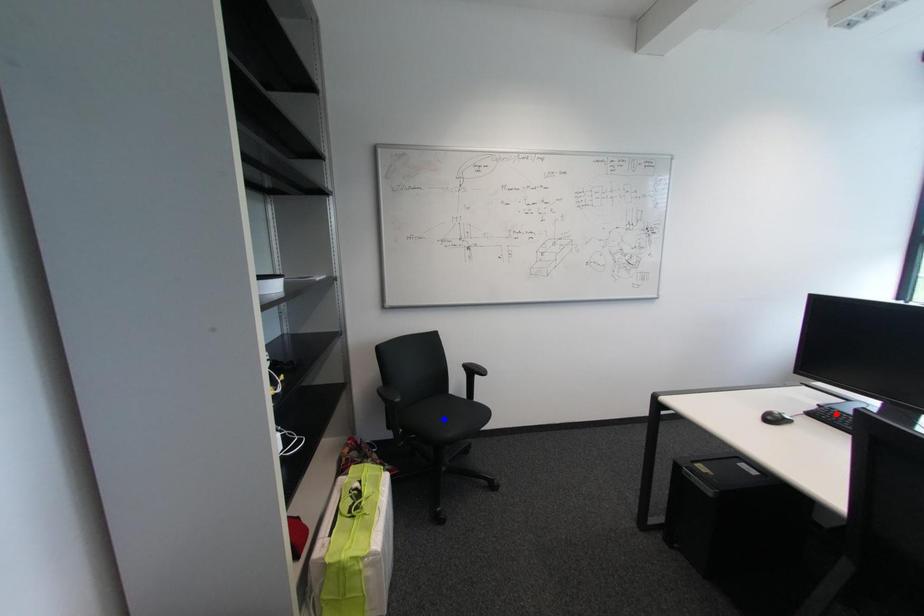
Question: Two points are marked on the image. Which point is closer to the camera?

Choices:
 (A) Blue point is closer.
 (B) Red point is closer.

Answer: (B)